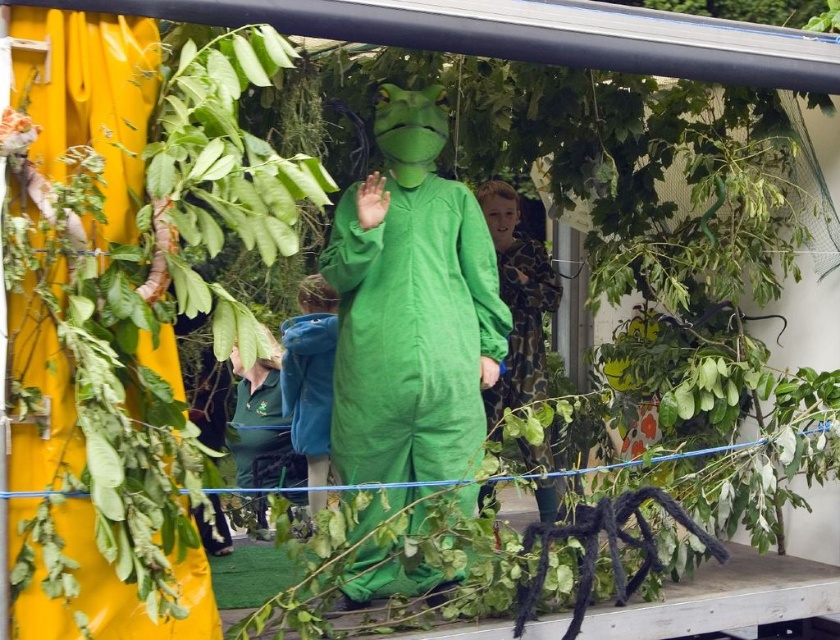
Which of these two, black fuzzy spider at lower right or green fabric bag at lower left, stands taller?

green fabric bag at lower left is taller.

Describe the element at coordinates (597, 548) in the screenshot. I see `black fuzzy spider at lower right` at that location.

Locate an element on the screen. The width and height of the screenshot is (840, 640). black fuzzy spider at lower right is located at coordinates (597, 548).

Does black fuzzy spider at lower right appear on the left side of blue velvet jacket at center?

In fact, black fuzzy spider at lower right is to the right of blue velvet jacket at center.

Between black fuzzy spider at lower right and blue velvet jacket at center, which one is positioned higher?

blue velvet jacket at center

Does point (685, 522) come behind point (318, 499)?

That is False.

Image resolution: width=840 pixels, height=640 pixels. Identify the location of black fuzzy spider at lower right. (597, 548).

Can you confirm if green matte costume at center is taller than black fuzzy spider at lower right?

Yes.

Can you confirm if green matte costume at center is positioned below black fuzzy spider at lower right?

Incorrect, green matte costume at center is not positioned below black fuzzy spider at lower right.

Where is `green matte costume at center`? The image size is (840, 640). green matte costume at center is located at coordinates (411, 307).

The width and height of the screenshot is (840, 640). I want to click on green matte costume at center, so click(x=411, y=307).